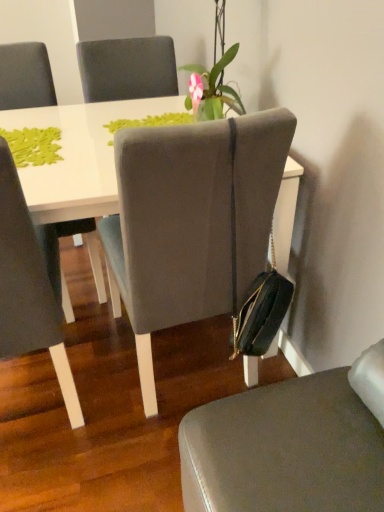
At what (x,y) coordinates should I click in order to perform the action: click on vacant point above matte gray chair at center, arranged as the 3th chair when viewed from the left (from a real-world perspective). Please return your answer as a coordinate pair (x, y). The image size is (384, 512). Looking at the image, I should click on (292, 435).